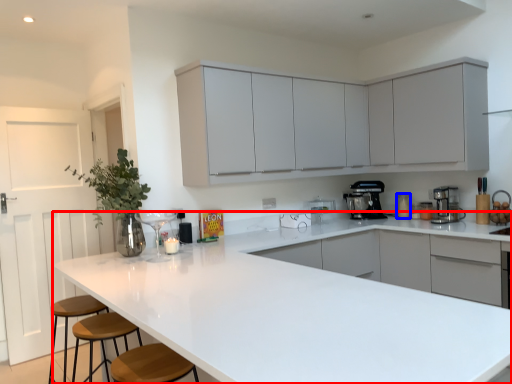
Question: Which point is further to the camera, countertop (highlighted by a red box) or appliance (highlighted by a blue box)?

Choices:
 (A) countertop
 (B) appliance

Answer: (B)